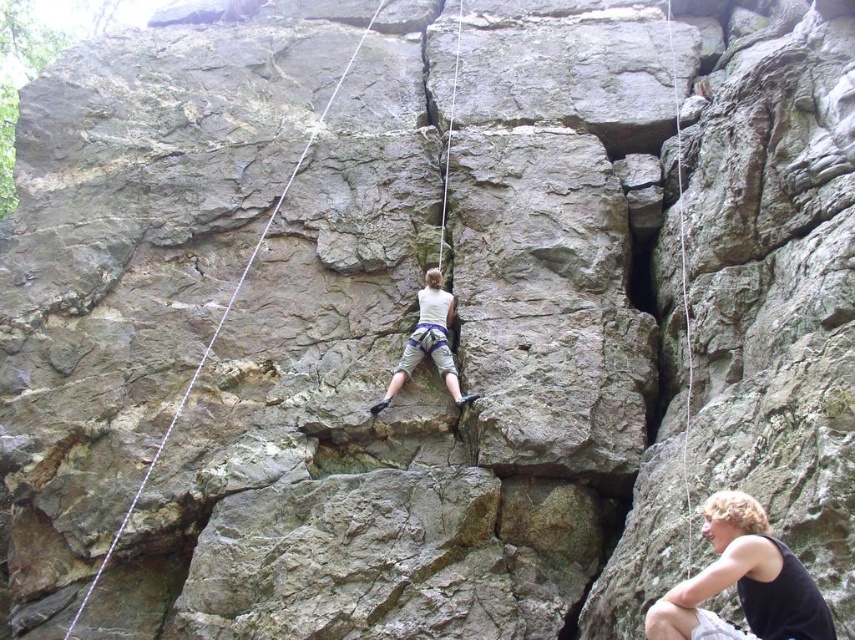
Question: From the image, what is the correct spatial relationship of white fabric climbing harness at center in relation to gray/rough rope at center?

Choices:
 (A) above
 (B) below

Answer: (B)

Question: Can you confirm if matte white tank top at center is positioned below gray/rough rope at center?

Choices:
 (A) yes
 (B) no

Answer: (A)

Question: Which object is positioned farthest from the gray/rough rope at center?

Choices:
 (A) matte white tank top at center
 (B) white fabric climbing harness at center

Answer: (A)

Question: Which point is farther from the camera taking this photo?

Choices:
 (A) (217, 328)
 (B) (423, 333)
 (C) (694, 634)

Answer: (A)

Question: Considering the relative positions of matte white tank top at center and gray/rough rope at center in the image provided, where is matte white tank top at center located with respect to gray/rough rope at center?

Choices:
 (A) left
 (B) right

Answer: (B)

Question: Which of the following is the farthest from the observer?

Choices:
 (A) (682, 259)
 (B) (441, 324)
 (C) (730, 534)
 (D) (113, 538)

Answer: (B)